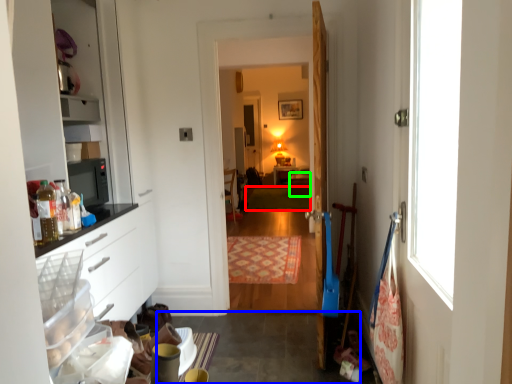
Question: Estimate the real-world distances between objects in this image. Which object is farther from mat (highlighted by a red box), concrete (highlighted by a blue box) or cabinetry (highlighted by a green box)?

Choices:
 (A) concrete
 (B) cabinetry

Answer: (A)